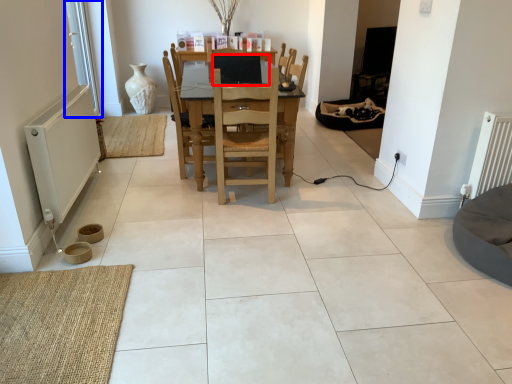
Question: Among these objects, which one is nearest to the camera, computer (highlighted by a red box) or window screen (highlighted by a blue box)?

Choices:
 (A) computer
 (B) window screen

Answer: (A)